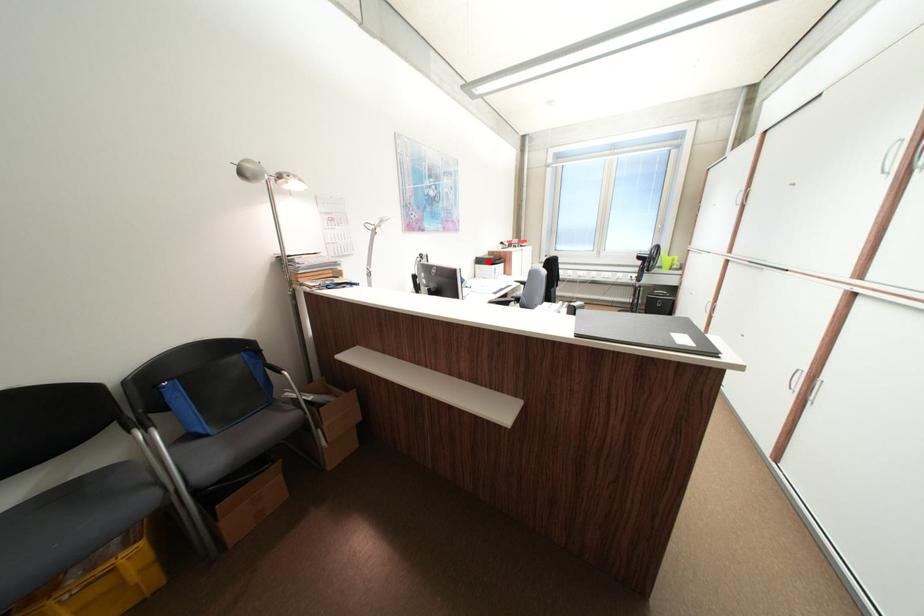
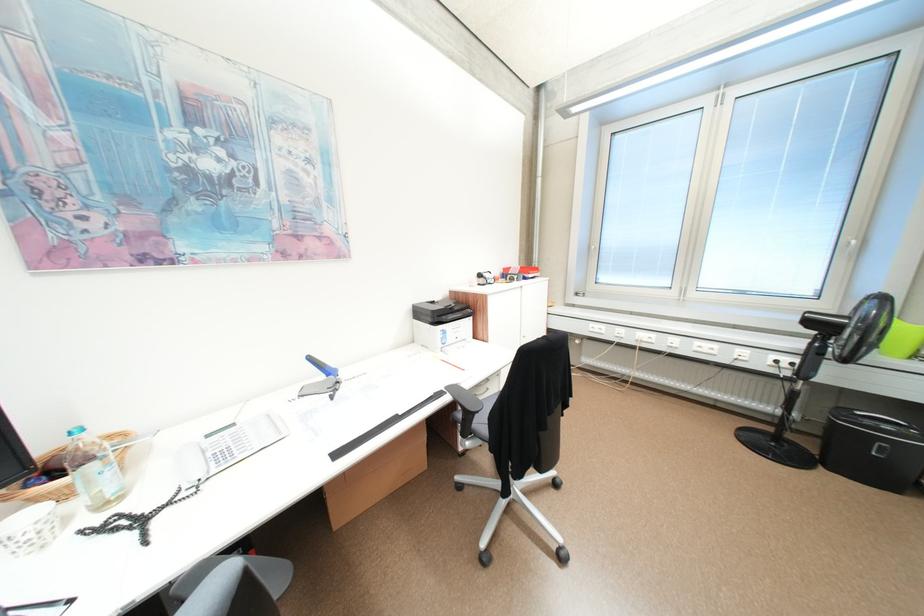
The point at the highlighted location is marked in the first image. Where is the corresponding point in the second image?

(428, 313)